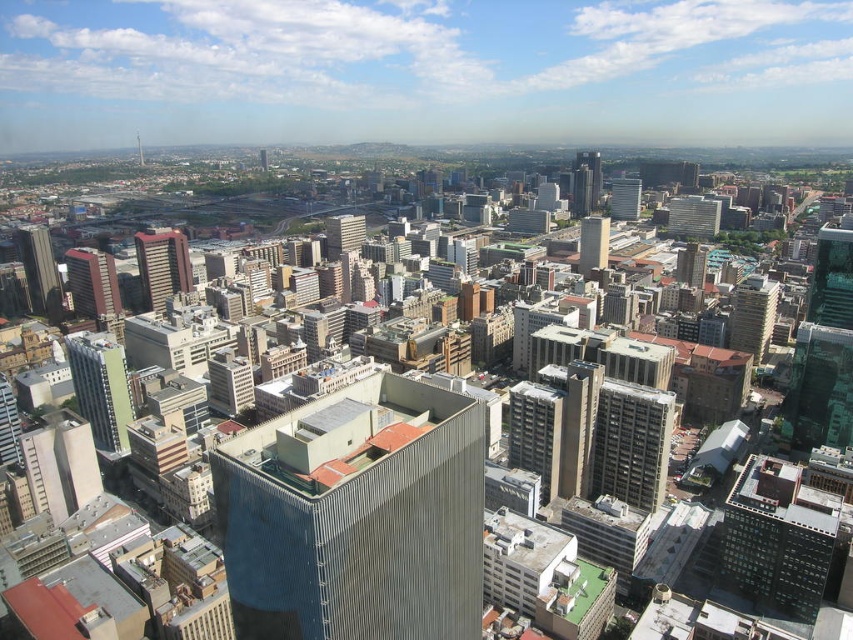
Question: From the image, what is the correct spatial relationship of green glass skyscraper at right in relation to smooth glass skyscraper at center?

Choices:
 (A) right
 (B) left

Answer: (A)

Question: Considering the real-world distances, which object is farthest from the matte glass skyscraper at upper center?

Choices:
 (A) green glass skyscraper at right
 (B) matte gray building at center
 (C) gray concrete building at lower left
 (D) smooth glass skyscraper at center

Answer: (C)

Question: Can you confirm if gray concrete building at lower left is positioned below matte glass skyscraper at upper center?

Choices:
 (A) yes
 (B) no

Answer: (A)

Question: Which object appears closest to the camera in this image?

Choices:
 (A) matte glass skyscraper at upper center
 (B) matte glass skyscraper at upper right
 (C) gray concrete building at lower left

Answer: (C)

Question: Which point appears farthest from the camera in this image?

Choices:
 (A) (688, 196)
 (B) (595, 246)

Answer: (A)

Question: Does matte brown skyscraper at center-left come behind matte gray skyscraper at center-left?

Choices:
 (A) no
 (B) yes

Answer: (B)